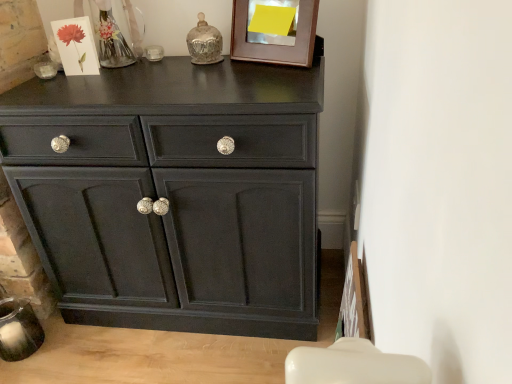
The height and width of the screenshot is (384, 512). Identify the location of wooden picture frame at upper center. pyautogui.click(x=274, y=31).

The width and height of the screenshot is (512, 384). What do you see at coordinates (274, 31) in the screenshot?
I see `wooden picture frame at upper center` at bounding box center [274, 31].

What is the approximate width of wooden picture frame at upper center?

wooden picture frame at upper center is 2.81 inches wide.

This screenshot has width=512, height=384. What do you see at coordinates (174, 194) in the screenshot?
I see `matte black cabinet at center` at bounding box center [174, 194].

Image resolution: width=512 pixels, height=384 pixels. Find the location of `matte black cabinet at center`. matte black cabinet at center is located at coordinates (174, 194).

You are a GUI agent. You are given a task and a screenshot of the screen. Output one action in this format:
    pyautogui.click(x=<x>, y=<y>)
    Task: Click on the wooden picture frame at upper center
    This screenshot has width=512, height=384.
    Given the screenshot: What is the action you would take?
    point(274,31)

Considering the positions of objects wooden picture frame at upper center and matte black cabinet at center in the image provided, who is more to the left, wooden picture frame at upper center or matte black cabinet at center?

From the viewer's perspective, matte black cabinet at center appears more on the left side.

Is wooden picture frame at upper center in front of or behind matte black cabinet at center in the image?

Visually, wooden picture frame at upper center is located behind matte black cabinet at center.

Which is less distant, (303, 2) or (232, 200)?

Point (303, 2) is positioned farther from the camera compared to point (232, 200).

From the image's perspective, between wooden picture frame at upper center and matte black cabinet at center, who is located below?

matte black cabinet at center.

From a real-world perspective, relative to matte black cabinet at center, is wooden picture frame at upper center vertically above or below?

wooden picture frame at upper center is situated higher than matte black cabinet at center in the real world.

Which of these two, wooden picture frame at upper center or matte black cabinet at center, is wider?

matte black cabinet at center.

Is wooden picture frame at upper center taller or shorter than matte black cabinet at center?

Considering their sizes, wooden picture frame at upper center has less height than matte black cabinet at center.

Considering the sizes of objects wooden picture frame at upper center and matte black cabinet at center in the image provided, who is smaller, wooden picture frame at upper center or matte black cabinet at center?

With smaller size is wooden picture frame at upper center.

Is matte black cabinet at center surrounded by wooden picture frame at upper center?

No, matte black cabinet at center is not a part of wooden picture frame at upper center.

Is wooden picture frame at upper center beside matte black cabinet at center?

No, wooden picture frame at upper center is not touching matte black cabinet at center.

Is wooden picture frame at upper center aimed at matte black cabinet at center?

No, wooden picture frame at upper center is not turned towards matte black cabinet at center.

What's the angular difference between wooden picture frame at upper center and matte black cabinet at center's facing directions?

25.3 degrees.

Locate an element on the screen. The width and height of the screenshot is (512, 384). picture frame located behind the matte black cabinet at center is located at coordinates (274, 31).

Is matte black cabinet at center to the left or to the right of wooden picture frame at upper center in the image?

matte black cabinet at center is positioned on wooden picture frame at upper center's left side.

Relative to wooden picture frame at upper center, is matte black cabinet at center in front or behind?

Visually, matte black cabinet at center is located in front of wooden picture frame at upper center.

Which is less distant, [138,162] or [272,43]?

Point [138,162] is positioned closer to the camera compared to point [272,43].

From the image's perspective, is matte black cabinet at center above or below wooden picture frame at upper center?

matte black cabinet at center is below wooden picture frame at upper center.

From a real-world perspective, is matte black cabinet at center under wooden picture frame at upper center?

Yes, from a real-world perspective, matte black cabinet at center is under wooden picture frame at upper center.

Which of these two, matte black cabinet at center or wooden picture frame at upper center, is wider?

matte black cabinet at center is wider.

From their relative heights in the image, would you say matte black cabinet at center is taller or shorter than wooden picture frame at upper center?

matte black cabinet at center is taller than wooden picture frame at upper center.

Looking at the image, does matte black cabinet at center seem bigger or smaller compared to wooden picture frame at upper center?

In the image, matte black cabinet at center appears to be larger than wooden picture frame at upper center.

Would you say wooden picture frame at upper center is part of matte black cabinet at center's contents?

No, matte black cabinet at center does not contain wooden picture frame at upper center.

Would you consider matte black cabinet at center to be distant from wooden picture frame at upper center?

matte black cabinet at center is near wooden picture frame at upper center, not far away.

Looking at this image, is matte black cabinet at center looking in the opposite direction of wooden picture frame at upper center?

No, matte black cabinet at center's orientation is not away from wooden picture frame at upper center.

Consider the image. How different are the orientations of matte black cabinet at center and wooden picture frame at upper center in degrees?

The facing directions of matte black cabinet at center and wooden picture frame at upper center are 25.3 degrees apart.

Measure the distance from matte black cabinet at center to wooden picture frame at upper center.

matte black cabinet at center is 16.78 inches away from wooden picture frame at upper center.

You are a GUI agent. You are given a task and a screenshot of the screen. Output one action in this format:
    pyautogui.click(x=<x>, y=<y>)
    Task: Click on the picture frame behind the matte black cabinet at center
    This screenshot has height=384, width=512.
    Given the screenshot: What is the action you would take?
    pyautogui.click(x=274, y=31)

You are a GUI agent. You are given a task and a screenshot of the screen. Output one action in this format:
    pyautogui.click(x=<x>, y=<y>)
    Task: Click on the chest of drawers below the wooden picture frame at upper center (from a real-world perspective)
    This screenshot has height=384, width=512.
    Given the screenshot: What is the action you would take?
    pyautogui.click(x=174, y=194)

I want to click on picture frame above the matte black cabinet at center (from a real-world perspective), so click(x=274, y=31).